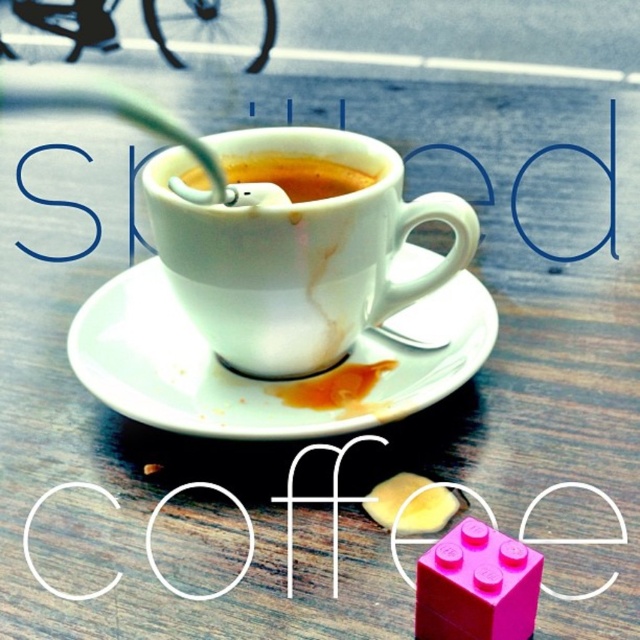
You are a barista trying to clean up a spilled coffee. You see the white ceramic saucer at center and the smooth porcelain cup at center. Which object is closer to you that you should handle first?

The white ceramic saucer at center is closer to the viewer than the smooth porcelain cup at center, so you should handle the white ceramic saucer at center first.

You are a barista trying to clean up a spill. You see the white ceramic saucer at center and the smooth porcelain cup at center. Which object is taller?

The white ceramic saucer at center is much taller than the smooth porcelain cup at center.

You are trying to determine which cup is larger in the scene. You see a white ceramic cup at center and a smooth porcelain cup at center. Which one is larger?

The white ceramic cup at center is larger than the smooth porcelain cup at center.